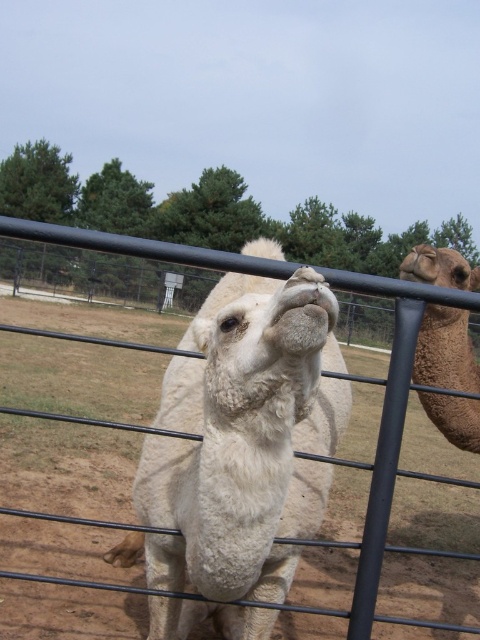
Based on the scene description, where is the white woolen camel at center located in the image?

The white woolen camel at center is located at point (241, 440).

You are a zookeeper who needs to check the distance between the white woolen camel at center and the black metal fence at center. Can you determine which one is closer to the camera based on the scene?

The white woolen camel at center is in front of the black metal fence at center, so the white woolen camel at center is closer to the camera than the black metal fence at center.